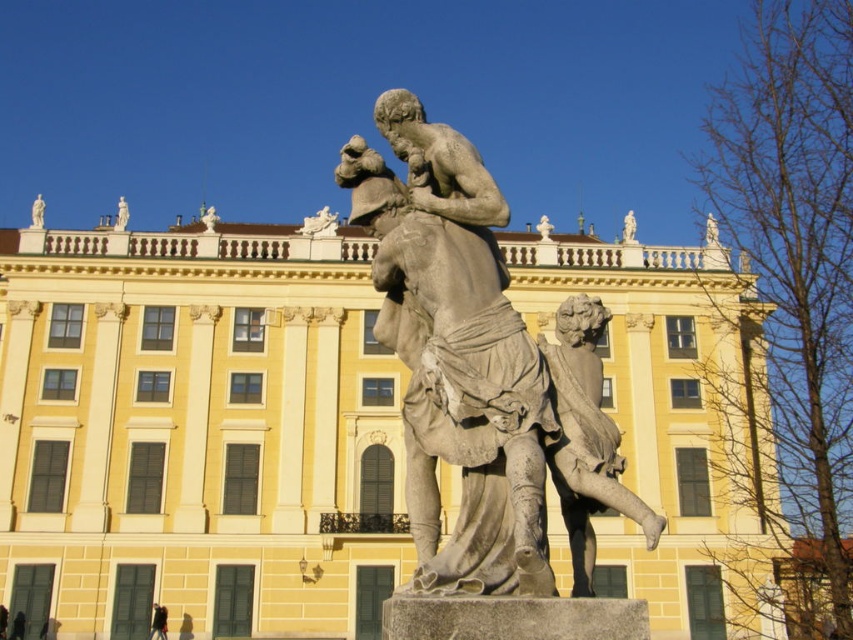
Based on the photo, you are standing at the base of the gray stone statue at center and want to walk to the entrance of the yellow stone building at center. Given that the average human walking speed is 3 miles per hour, how many seconds will it take you to reach the building?

The distance between the gray stone statue at center and the yellow stone building at center is 139.10 feet. Converting feet to miles, 139.10 feet is approximately 0.0264 miles. At a walking speed of 3 mph, the time taken would be distance divided by speed, so 0.0264 miles divided by 3 mph equals approximately 0.0088 hours. Converting hours to seconds, 0.0088 hours multiplied by 3600 seconds per hour gives roughly 31.68 seconds. Therefore, it would take about 32 seconds to reach the building.

You are standing at the entrance of the yellow stone building at center. If you look towards the statues atop the building, in which direction relative to the building should you face?

The yellow stone building at center is located at point (x=196, y=432), so you should face upwards to look at the statues atop the building since they are positioned above the building.